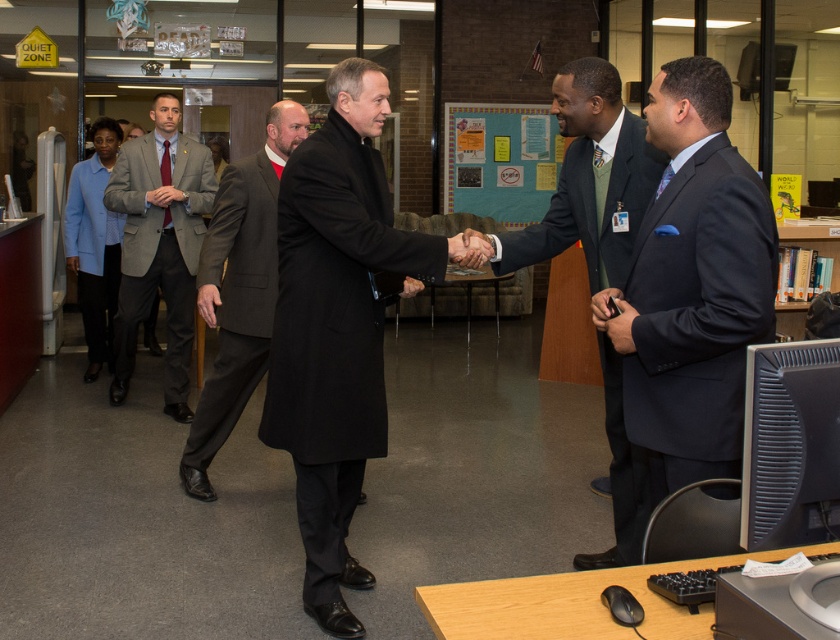
Is dark blue suit at right smaller than dark gray suit at center?

No.

Is dark blue suit at right to the right of dark gray suit at center from the viewer's perspective?

Yes, dark blue suit at right is to the right of dark gray suit at center.

Who is more forward, (669, 205) or (227, 433)?

Positioned in front is point (669, 205).

At what (x,y) coordinates should I click in order to perform the action: click on dark blue suit at right. Please return your answer as a coordinate pair (x, y). This screenshot has width=840, height=640. Looking at the image, I should click on (690, 292).

Is point (274, 368) in front of point (77, 256)?

Yes.

Locate an element on the screen. This screenshot has width=840, height=640. black matte coat at center is located at coordinates (339, 326).

Is dark blue suit at right above light blue fabric jacket at left?

No, dark blue suit at right is not above light blue fabric jacket at left.

Is dark blue suit at right taller than light blue fabric jacket at left?

Correct, dark blue suit at right is much taller as light blue fabric jacket at left.

Is point (667, 81) less distant than point (102, 333)?

That is True.

What are the coordinates of `dark blue suit at right` in the screenshot? It's located at (690, 292).